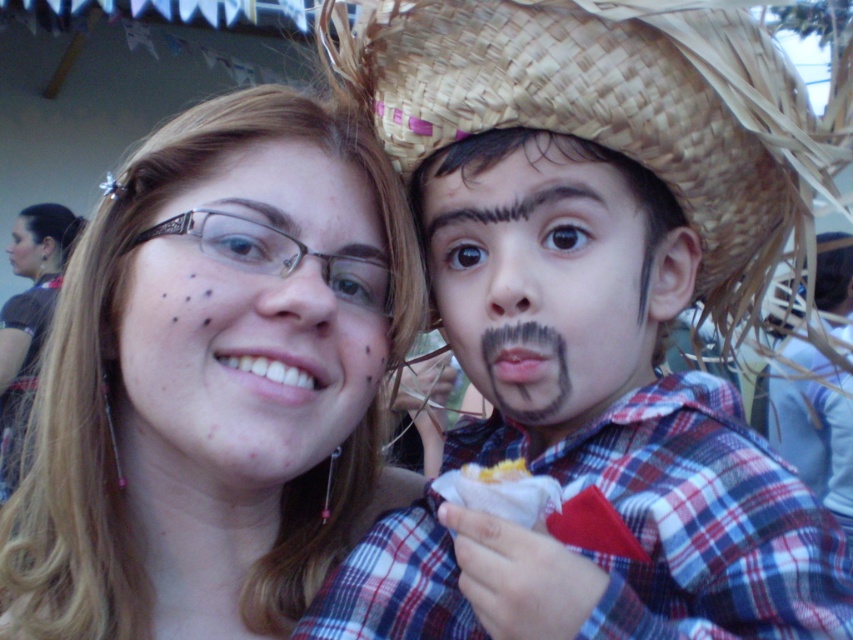
You are a photographer trying to decide where to place a small prop between the two people in the photo. The prop needs to be placed between the brown woven straw cowboy hat at right and the black hair at upper left. Which side of the prop should be closer to the thinner object?

The brown woven straw cowboy hat at right is thinner than the black hair at upper left. Therefore, the side of the prop closer to the brown woven straw cowboy hat at right should be placed near the thinner object.

You are a photographer adjusting your camera settings. You notice the black matte mustache at center is too blurry in the photo. What should you adjust to ensure it becomes clearer?

To ensure the black matte mustache at center becomes clearer, adjust the camera focus to 28.74 inches, matching the distance of the mustache from the camera.

You are a photographer trying to adjust the lighting for a portrait. You notice the matte black hair at upper left and the smooth skin face at center. Which object is positioned lower in the frame?

The matte black hair at upper left is located below the smooth skin face at center, so it is positioned lower in the frame.